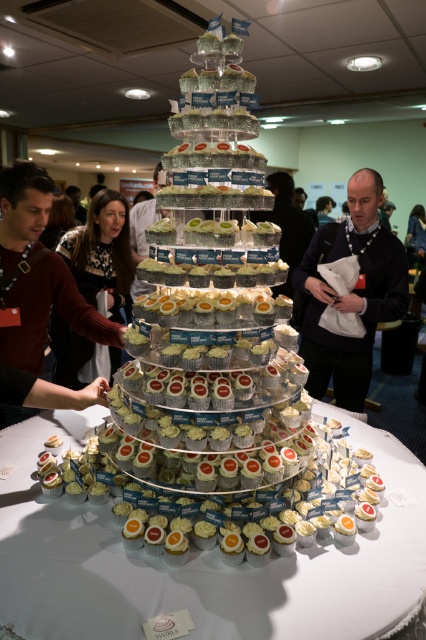
Which is above, dark brown sweater at center or matte black jacket at center?

matte black jacket at center is higher up.

Is dark brown sweater at center further to camera compared to matte black jacket at center?

No, dark brown sweater at center is in front of matte black jacket at center.

Describe the element at coordinates (101, 252) in the screenshot. The width and height of the screenshot is (426, 640). I see `dark brown sweater at center` at that location.

In order to click on dark brown sweater at center in this screenshot , I will do `click(101, 252)`.

Image resolution: width=426 pixels, height=640 pixels. What are the coordinates of `white paper cupcake tower at center` in the screenshot? It's located at (203, 563).

Is white paper cupcake tower at center thinner than dark brown leather jacket at center?

In fact, white paper cupcake tower at center might be wider than dark brown leather jacket at center.

Is point (8, 484) less distant than point (325, 214)?

Yes, it is in front of point (325, 214).

This screenshot has height=640, width=426. I want to click on white paper cupcake tower at center, so pyautogui.click(x=203, y=563).

Does white frosted cupcake tower at center have a lesser width compared to dark red sweater at left?

In fact, white frosted cupcake tower at center might be wider than dark red sweater at left.

Does white frosted cupcake tower at center appear on the left side of dark red sweater at left?

No, white frosted cupcake tower at center is not to the left of dark red sweater at left.

This screenshot has width=426, height=640. What do you see at coordinates (213, 300) in the screenshot?
I see `white frosted cupcake tower at center` at bounding box center [213, 300].

This screenshot has width=426, height=640. What are the coordinates of `white frosted cupcake tower at center` in the screenshot? It's located at (213, 300).